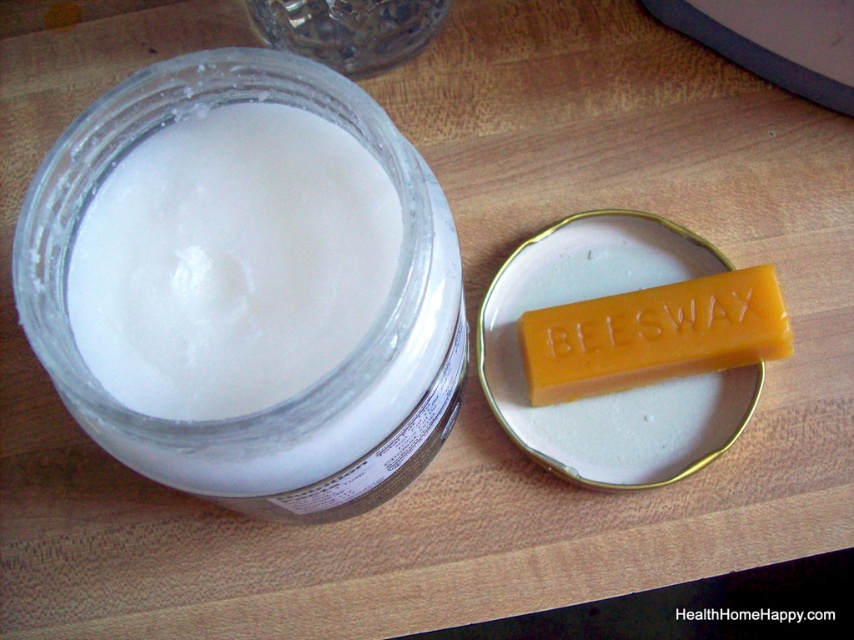
Question: Does white matte jar at center have a greater width compared to transparent glass jar at upper center?

Choices:
 (A) no
 (B) yes

Answer: (B)

Question: Which point is closer to the camera?

Choices:
 (A) yellow beeswax bar at center
 (B) transparent glass jar at upper center
 (C) white matte jar at center

Answer: (C)

Question: Which of the following is the farthest from the observer?

Choices:
 (A) (676, 372)
 (B) (174, 324)
 (C) (389, 29)

Answer: (C)

Question: Can you confirm if white matte jar at center is positioned to the right of transparent glass jar at upper center?

Choices:
 (A) yes
 (B) no

Answer: (B)

Question: Which point is closer to the camera?

Choices:
 (A) (580, 364)
 (B) (442, 317)
 (C) (256, 24)

Answer: (B)

Question: Can you confirm if white matte jar at center is wider than transparent glass jar at upper center?

Choices:
 (A) yes
 (B) no

Answer: (A)